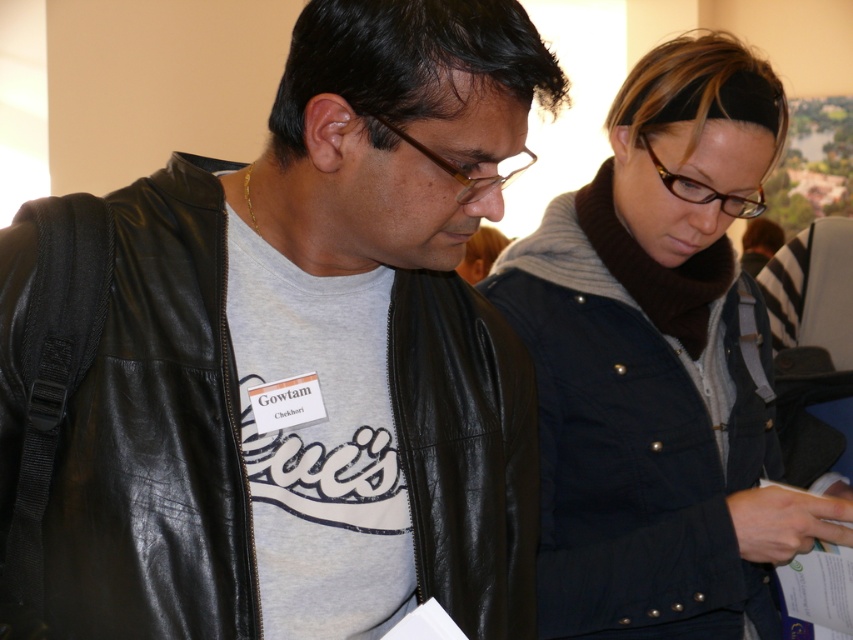
Question: Does black leather jacket at left appear on the left side of dark blue jacket at center?

Choices:
 (A) yes
 (B) no

Answer: (A)

Question: Among these points, which one is nearest to the camera?

Choices:
 (A) (596, 403)
 (B) (126, 445)

Answer: (B)

Question: Observing the image, what is the correct spatial positioning of black leather jacket at left in reference to dark blue jacket at center?

Choices:
 (A) below
 (B) above

Answer: (A)

Question: Which point appears closest to the camera in this image?

Choices:
 (A) (698, 513)
 (B) (80, 436)

Answer: (B)

Question: Is black leather jacket at left closer to camera compared to dark blue jacket at center?

Choices:
 (A) yes
 (B) no

Answer: (A)